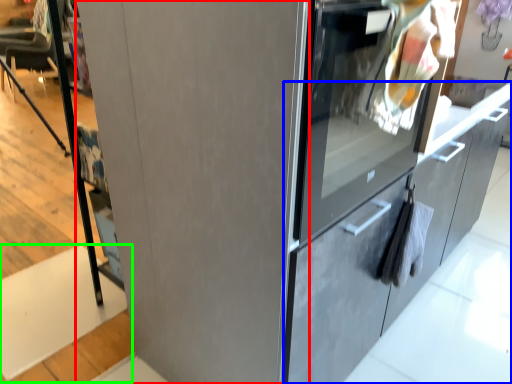
Question: Which object is positioned closest to door (highlighted by a red box)? Select from cabinetry (highlighted by a blue box) and stair (highlighted by a green box).

Choices:
 (A) cabinetry
 (B) stair

Answer: (A)